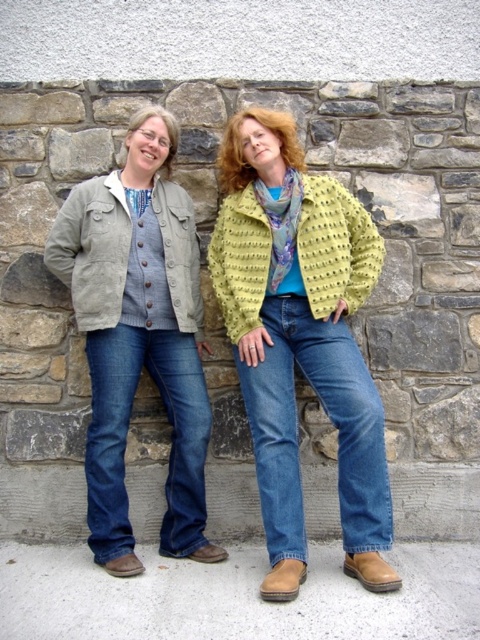
Does matte gray jacket at left have a greater width compared to lime textured cardigan at center?

Yes.

Between matte gray jacket at left and lime textured cardigan at center, which one is positioned higher?

lime textured cardigan at center is higher up.

The width and height of the screenshot is (480, 640). Describe the element at coordinates (139, 336) in the screenshot. I see `matte gray jacket at left` at that location.

You are a GUI agent. You are given a task and a screenshot of the screen. Output one action in this format:
    pyautogui.click(x=<x>, y=<y>)
    Task: Click on the matte gray jacket at left
    The width and height of the screenshot is (480, 640).
    Given the screenshot: What is the action you would take?
    pyautogui.click(x=139, y=336)

Which is behind, point (250, 266) or point (96, 323)?

Point (250, 266)

Where is `matte gray jacket at center`? matte gray jacket at center is located at coordinates (301, 348).

Based on the photo, is matte gray jacket at left wider than multicolored silk scarf at center?

Indeed, matte gray jacket at left has a greater width compared to multicolored silk scarf at center.

Which is below, matte gray jacket at left or multicolored silk scarf at center?

matte gray jacket at left

The image size is (480, 640). I want to click on matte gray jacket at left, so click(x=139, y=336).

The height and width of the screenshot is (640, 480). Find the location of `matte gray jacket at left`. matte gray jacket at left is located at coordinates (139, 336).